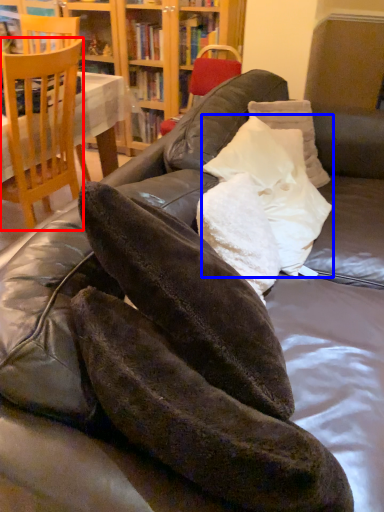
Question: Which object appears farthest to the camera in this image, chair (highlighted by a red box) or pillow (highlighted by a blue box)?

Choices:
 (A) chair
 (B) pillow

Answer: (A)